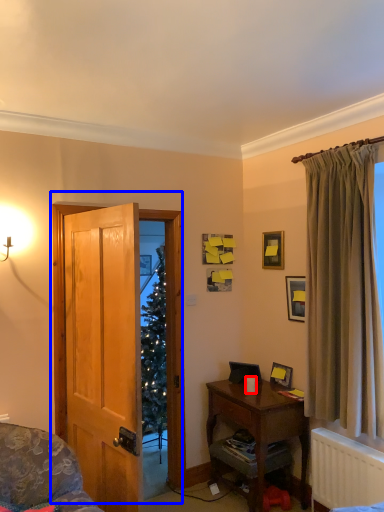
Question: Which object is closer to the camera taking this photo, coffee cup (highlighted by a red box) or door (highlighted by a blue box)?

Choices:
 (A) coffee cup
 (B) door

Answer: (B)